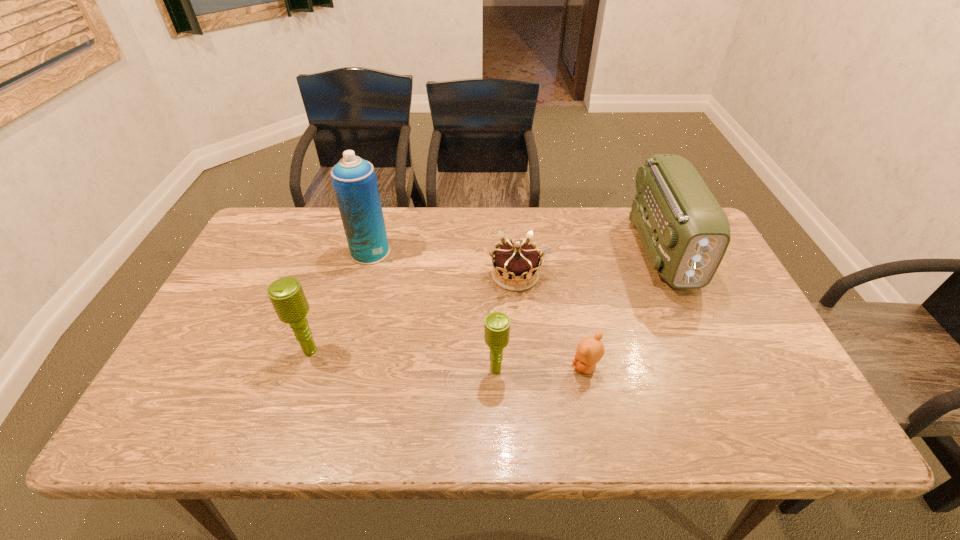
Locate an element on the screen. The image size is (960, 540). object situated at the far right corner is located at coordinates tap(685, 232).

Find the location of a particular element. This screenshot has width=960, height=540. vacant space at the far edge of the desktop is located at coordinates (442, 208).

Where is `vacant area at the near edge of the desktop`? The height and width of the screenshot is (540, 960). vacant area at the near edge of the desktop is located at coordinates (410, 394).

The width and height of the screenshot is (960, 540). Identify the location of vacant space at the left edge of the desktop. (280, 278).

This screenshot has height=540, width=960. Find the location of `free space between the right microphone and the rightmost object`. free space between the right microphone and the rightmost object is located at coordinates (579, 310).

You are a GUI agent. You are given a task and a screenshot of the screen. Output one action in this format:
    pyautogui.click(x=<x>, y=<y>)
    Task: Click on the free spot between the teddy bear and the crown
    The height and width of the screenshot is (540, 960).
    Given the screenshot: What is the action you would take?
    pyautogui.click(x=550, y=321)

Where is `free spot between the left microphone and the aerosol can`? The height and width of the screenshot is (540, 960). free spot between the left microphone and the aerosol can is located at coordinates (341, 301).

Image resolution: width=960 pixels, height=540 pixels. I want to click on free spot between the fifth object from left to right and the radio_receiver, so click(624, 309).

The height and width of the screenshot is (540, 960). Find the location of `unoccupied position between the aerosol can and the shorter microphone`. unoccupied position between the aerosol can and the shorter microphone is located at coordinates click(x=433, y=311).

Where is `free space between the taller microphone and the rightmost object`? free space between the taller microphone and the rightmost object is located at coordinates (487, 300).